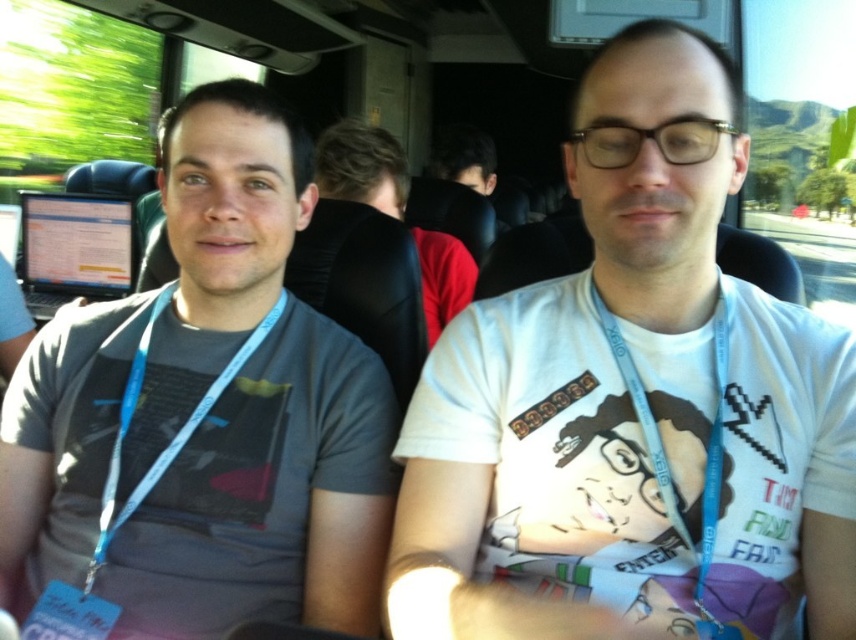
You are a photographer trying to capture a candid shot of the two people in the scene. You want to ensure that neither the dark brown leather jacket at center nor the blue fabric lanyard at left obstructs the subjects. Based on their positions, which item is more likely to block your view?

The dark brown leather jacket at center is wider than the blue fabric lanyard at left, so it is more likely to block your view.

You are a passenger on a bus and need to retrieve an item from your bag located behind you. There is a dark brown leather jacket at center and a blue fabric lanyard at left in your way. Which object is taller and might block your reach?

The dark brown leather jacket at center is much taller than the blue fabric lanyard at left, so it might block your reach more.